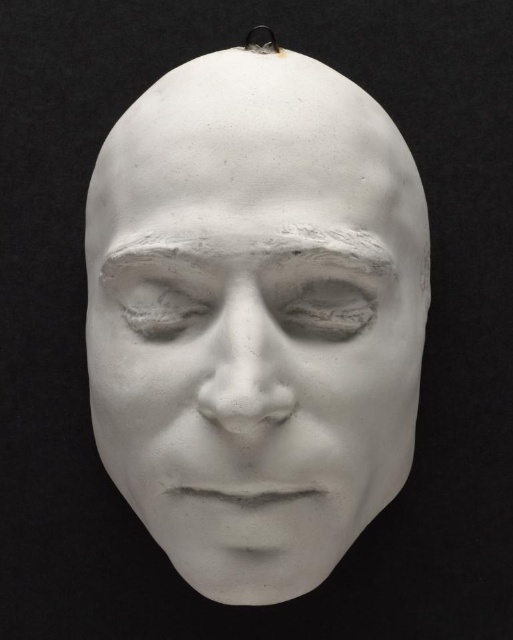
Between point (129, 186) and point (283, 58), which one is positioned behind?

Point (283, 58)

Is point (100, 250) positioned behind point (349, 92)?

Yes, it is behind point (349, 92).

Where is `white matte mask at center`? This screenshot has height=640, width=513. white matte mask at center is located at coordinates (252, 317).

Does white matte plaster forehead at upper center have a smaller size compared to matte white eye at center?

No, white matte plaster forehead at upper center is not smaller than matte white eye at center.

Where is `white matte plaster forehead at upper center`? The width and height of the screenshot is (513, 640). white matte plaster forehead at upper center is located at coordinates (254, 156).

Is point (293, 182) positioned behind point (364, 292)?

No, it is not.

Where is `white matte plaster forehead at upper center`? The image size is (513, 640). white matte plaster forehead at upper center is located at coordinates (254, 156).

What do you see at coordinates (252, 317) in the screenshot?
I see `white matte mask at center` at bounding box center [252, 317].

Is white matte mask at center thinner than matte white eye at center?

No, white matte mask at center is not thinner than matte white eye at center.

Who is more forward, (159, 541) or (315, 292)?

Point (315, 292) is more forward.

Find the location of `white matte mask at center`. white matte mask at center is located at coordinates (252, 317).